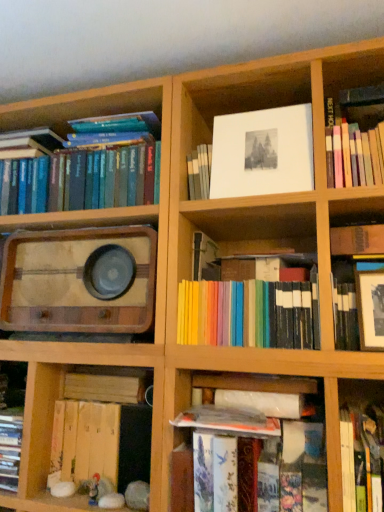
Where is `hardcover books at left, which is the 7th book in right-to-left order`? The height and width of the screenshot is (512, 384). hardcover books at left, which is the 7th book in right-to-left order is located at coordinates (81, 166).

Describe the element at coordinates (251, 305) in the screenshot. I see `pastel rainbow books at center, positioned as the 4th book in right-to-left order` at that location.

Locate an element on the screen. Image resolution: width=384 pixels, height=512 pixels. hardcover book at lower right, positioned as the third book in right-to-left order is located at coordinates (360, 462).

You are a GUI agent. You are given a task and a screenshot of the screen. Output one action in this format:
    pyautogui.click(x=<x>, y=<y>)
    Task: Click on the hardcover books at left, placed as the 1th book when sorted from left to right
    Image resolution: width=384 pixels, height=512 pixels.
    Given the screenshot: What is the action you would take?
    pyautogui.click(x=81, y=166)

Which object is more forward, hardcover book at lower right, which is counted as the fifth book, starting from the left, or white paper at upper center?

hardcover book at lower right, which is counted as the fifth book, starting from the left, is more forward.

Is hardcover book at lower right, which is counted as the fifth book, starting from the left, looking in the opposite direction of white paper at upper center?

That's not correct — hardcover book at lower right, which is counted as the fifth book, starting from the left, is not looking away from white paper at upper center.

This screenshot has width=384, height=512. Find the location of `the 6th book below when counting from the white paper at upper center (from the image's perspective)`. the 6th book below when counting from the white paper at upper center (from the image's perspective) is located at coordinates (360, 462).

Locate an element on the screen. the 6th book to the right of the hardcover books at left, which is the 7th book in right-to-left order, counting from the anchor's position is located at coordinates (356, 138).

Which object is more forward, hardcover books at left, which is the 7th book in right-to-left order, or hardcover book at upper right, arranged as the 1th book when viewed from the right?

hardcover book at upper right, arranged as the 1th book when viewed from the right, is in front.

Considering the sizes of objects hardcover books at left, which is the 7th book in right-to-left order, and hardcover book at upper right, marked as the seventh book in a left-to-right arrangement, in the image provided, who is wider, hardcover books at left, which is the 7th book in right-to-left order, or hardcover book at upper right, marked as the seventh book in a left-to-right arrangement,?

hardcover book at upper right, marked as the seventh book in a left-to-right arrangement, is wider.

From a real-world perspective, which is physically below, hardcover books at left, which is the 7th book in right-to-left order, or hardcover book at upper right, arranged as the 1th book when viewed from the right?

hardcover book at upper right, arranged as the 1th book when viewed from the right, from a real-world perspective.

From the image's perspective, is wooden plank at lower left, the 6th book positioned from the right, located above or below hardcover book at lower right, positioned as the third book in right-to-left order?

wooden plank at lower left, the 6th book positioned from the right, is situated higher than hardcover book at lower right, positioned as the third book in right-to-left order, in the image.

The height and width of the screenshot is (512, 384). There is a wooden plank at lower left, the 6th book positioned from the right. Identify the location of the 1st book below it (from the image's perspective). (360, 462).

Is hardcover book at lower right, which is counted as the fifth book, starting from the left, surrounded by wooden plank at lower left, the 6th book positioned from the right?

That's incorrect, hardcover book at lower right, which is counted as the fifth book, starting from the left, is not inside wooden plank at lower left, the 6th book positioned from the right.

Is hardcover book at lower right, which is counted as the fifth book, starting from the left, at the back of hardcover book at upper right, arranged as the 1th book when viewed from the right?

No.

From a real-world perspective, who is located higher, hardcover book at upper right, arranged as the 1th book when viewed from the right, or hardcover book at lower right, which is counted as the fifth book, starting from the left?

In real-world perspective, hardcover book at upper right, arranged as the 1th book when viewed from the right, is above.

Is hardcover book at upper right, arranged as the 1th book when viewed from the right, thinner than hardcover book at lower right, positioned as the third book in right-to-left order?

In fact, hardcover book at upper right, arranged as the 1th book when viewed from the right, might be wider than hardcover book at lower right, positioned as the third book in right-to-left order.

Is point (80, 372) positioned before point (136, 251)?

That is False.

Are wooden plank at lower left, the 2th book when ordered from left to right, and wooden vintage radio at left making contact?

No, wooden plank at lower left, the 2th book when ordered from left to right, is not next to wooden vintage radio at left.

How far apart are wooden plank at lower left, the 2th book when ordered from left to right, and wooden vintage radio at left?

10.42 inches.

Can we say wooden plank at lower left, the 2th book when ordered from left to right, lies outside wooden vintage radio at left?

Yes, wooden plank at lower left, the 2th book when ordered from left to right, is outside of wooden vintage radio at left.

Which is behind, point (200, 253) or point (376, 174)?

Positioned behind is point (200, 253).

Is pastel rainbow books at center, positioned as the 4th book in right-to-left order, to the left or to the right of hardcover book at upper right, marked as the seventh book in a left-to-right arrangement, in the image?

pastel rainbow books at center, positioned as the 4th book in right-to-left order, is to the left of hardcover book at upper right, marked as the seventh book in a left-to-right arrangement.

From the image's perspective, which one is positioned lower, pastel rainbow books at center, arranged as the 4th book when viewed from the left, or hardcover book at upper right, marked as the seventh book in a left-to-right arrangement?

pastel rainbow books at center, arranged as the 4th book when viewed from the left.

From a real-world perspective, which is physically below, pastel rainbow books at center, positioned as the 4th book in right-to-left order, or hardcover book at upper right, arranged as the 1th book when viewed from the right?

pastel rainbow books at center, positioned as the 4th book in right-to-left order.

Which of these two, white paper at upper center or hardcover books at left, which is the 7th book in right-to-left order, stands shorter?

hardcover books at left, which is the 7th book in right-to-left order.

Which object is positioned more to the right, white paper at upper center or hardcover books at left, placed as the 1th book when sorted from left to right?

white paper at upper center is more to the right.

Are white paper at upper center and hardcover books at left, placed as the 1th book when sorted from left to right, far apart?

Actually, white paper at upper center and hardcover books at left, placed as the 1th book when sorted from left to right, are a little close together.

From the image's perspective, is white paper at upper center above hardcover books at left, placed as the 1th book when sorted from left to right?

Yes, from the image's perspective, white paper at upper center is above hardcover books at left, placed as the 1th book when sorted from left to right.

There is a white paper at upper center. In order to click on the 6th book below it (from the image's perspective) in this screenshot , I will do `click(360, 462)`.

Locate an element on the screen. This screenshot has height=512, width=384. the 3rd book in front of the hardcover books at left, placed as the 1th book when sorted from left to right is located at coordinates (356, 138).

Considering their positions, is hardcover books at lower center positioned further to white paper at upper center than wooden book at lower left, which is counted as the fifth book, starting from the right?

Among the two, wooden book at lower left, which is counted as the fifth book, starting from the right, is located further to white paper at upper center.

From the picture: Based on their spatial positions, is wooden vintage radio at left or white paper at upper center closer to matte black frame at upper right, marked as the sixth book in a left-to-right arrangement?

white paper at upper center lies closer to matte black frame at upper right, marked as the sixth book in a left-to-right arrangement, than the other object.

From the image, which object appears to be farther from wooden plank at lower left, the 6th book positioned from the right, hardcover books at left, placed as the 1th book when sorted from left to right, or hardcover book at lower right, positioned as the third book in right-to-left order?

The object further to wooden plank at lower left, the 6th book positioned from the right, is hardcover book at lower right, positioned as the third book in right-to-left order.

Estimate the real-world distances between objects in this image. Which object is further from hardcover books at left, which is the 7th book in right-to-left order, hardcover book at lower right, which is counted as the fifth book, starting from the left, or hardcover books at lower center?

Based on the image, hardcover book at lower right, which is counted as the fifth book, starting from the left, appears to be further to hardcover books at left, which is the 7th book in right-to-left order.

Looking at the image, which one is located further to wooden vintage radio at left, pastel rainbow books at center, positioned as the 4th book in right-to-left order, or matte black frame at upper right, marked as the second book in a right-to-left arrangement?

matte black frame at upper right, marked as the second book in a right-to-left arrangement.

Which object lies further to the anchor point wooden plank at lower left, the 2th book when ordered from left to right, wooden vintage radio at left or matte black frame at upper right, marked as the second book in a right-to-left arrangement?

Based on the image, matte black frame at upper right, marked as the second book in a right-to-left arrangement, appears to be further to wooden plank at lower left, the 2th book when ordered from left to right.

Estimate the real-world distances between objects in this image. Which object is further from hardcover books at lower center, pastel rainbow books at center, arranged as the 4th book when viewed from the left, or matte black frame at upper right, marked as the sixth book in a left-to-right arrangement?

Based on the image, matte black frame at upper right, marked as the sixth book in a left-to-right arrangement, appears to be further to hardcover books at lower center.

Based on their spatial positions, is matte black frame at upper right, marked as the second book in a right-to-left arrangement, or pastel rainbow books at center, positioned as the 4th book in right-to-left order, closer to hardcover books at lower center?

pastel rainbow books at center, positioned as the 4th book in right-to-left order.

Find the location of a particular element. The image size is (384, 512). stereo between hardcover books at left, which is the 7th book in right-to-left order, and wooden book at lower left, which is counted as the fifth book, starting from the right, from top to bottom is located at coordinates (76, 281).

What are the coordinates of `shelf between hardcover books at left, placed as the 1th book when sorted from left to right, and wooden book at lower left, placed as the third book when sorted from left to right, vertically` in the screenshot? It's located at (286, 454).

Identify the location of shelf between wooden plank at lower left, the 6th book positioned from the right, and pastel rainbow books at center, arranged as the 4th book when viewed from the left, in the horizontal direction. click(286, 454).

Identify the location of shelf between wooden plank at lower left, the 6th book positioned from the right, and matte black frame at upper right, marked as the second book in a right-to-left arrangement, in the horizontal direction. The image size is (384, 512). (286, 454).